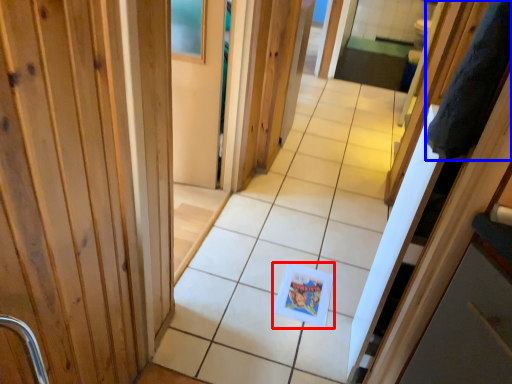
Question: Among these objects, which one is nearest to the camera, postcard (highlighted by a red box) or robe (highlighted by a blue box)?

Choices:
 (A) postcard
 (B) robe

Answer: (B)